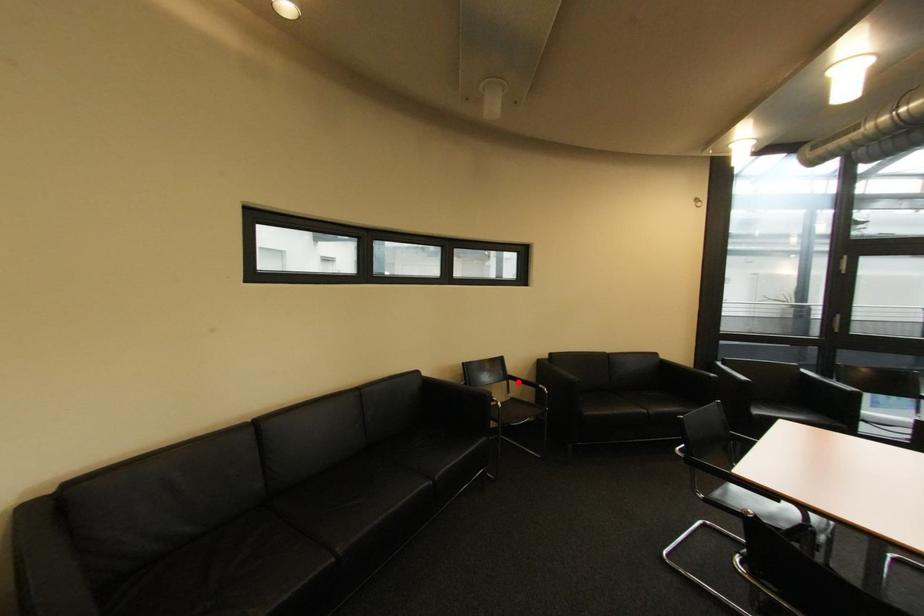
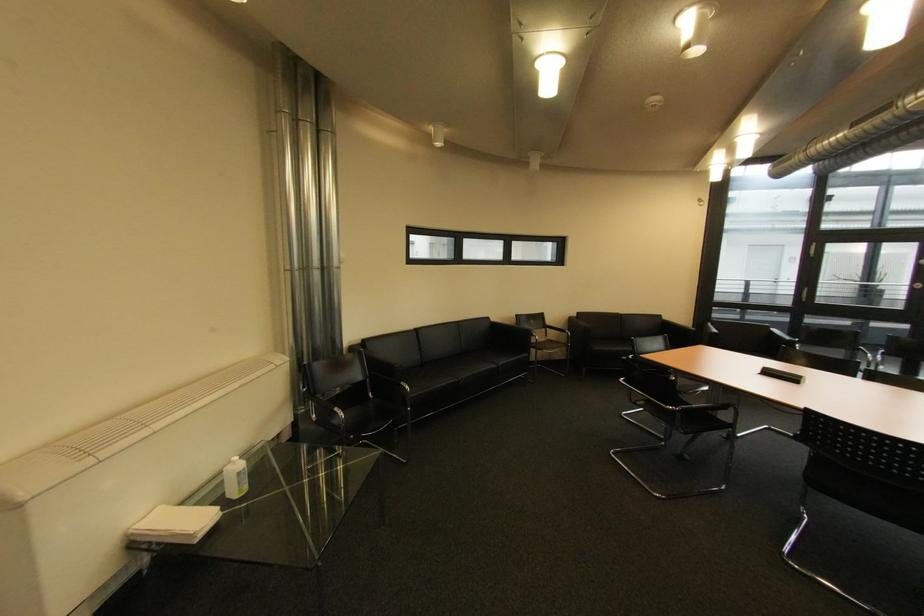
Question: I am providing you with two images of the same scene from different viewpoints. Image1 has a red point marked. In image2, the corresponding 3D location appears at what relative position? Reply with the corresponding letter.

Choices:
 (A) Closer
 (B) Farther

Answer: (A)